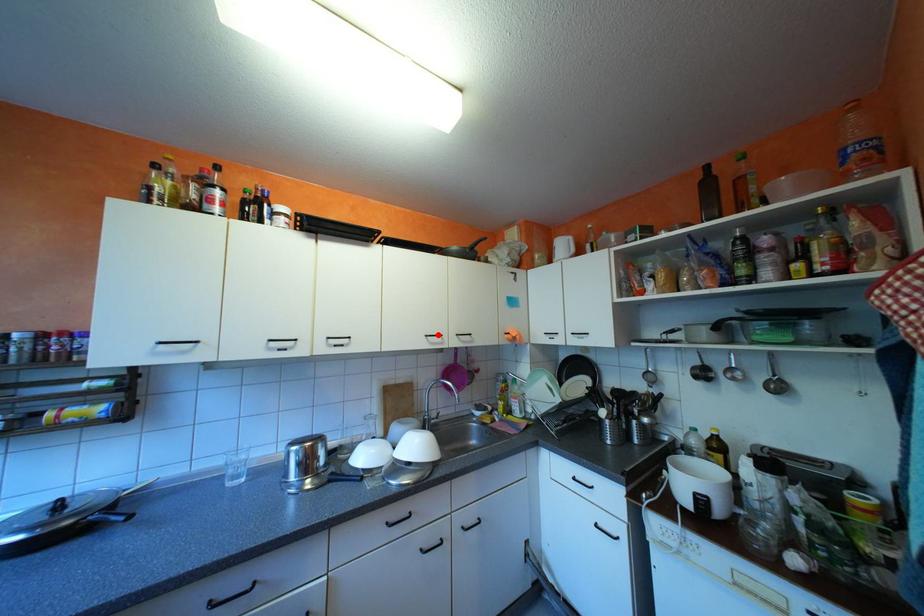
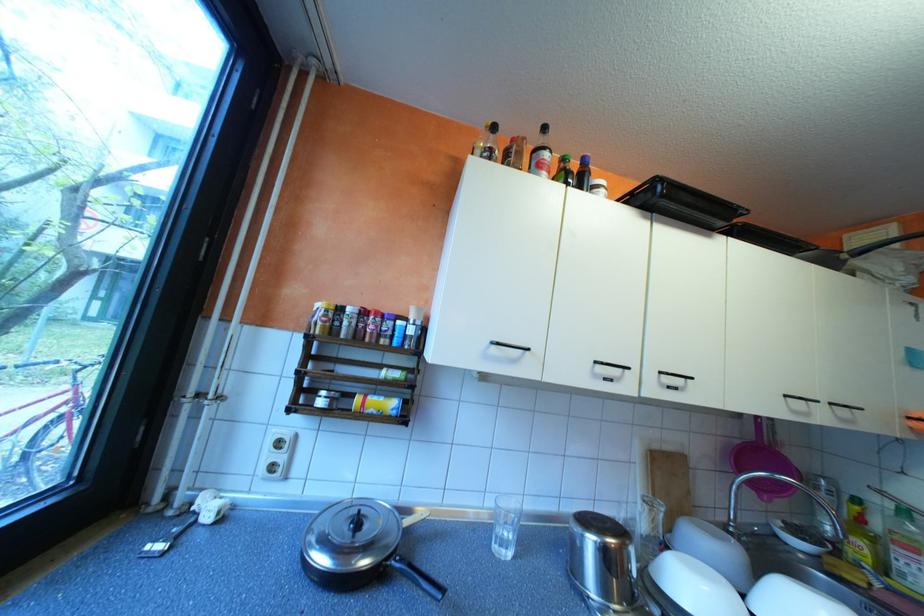
Find the pixel in the second image that matches the highlighted location in the first image.

(797, 395)